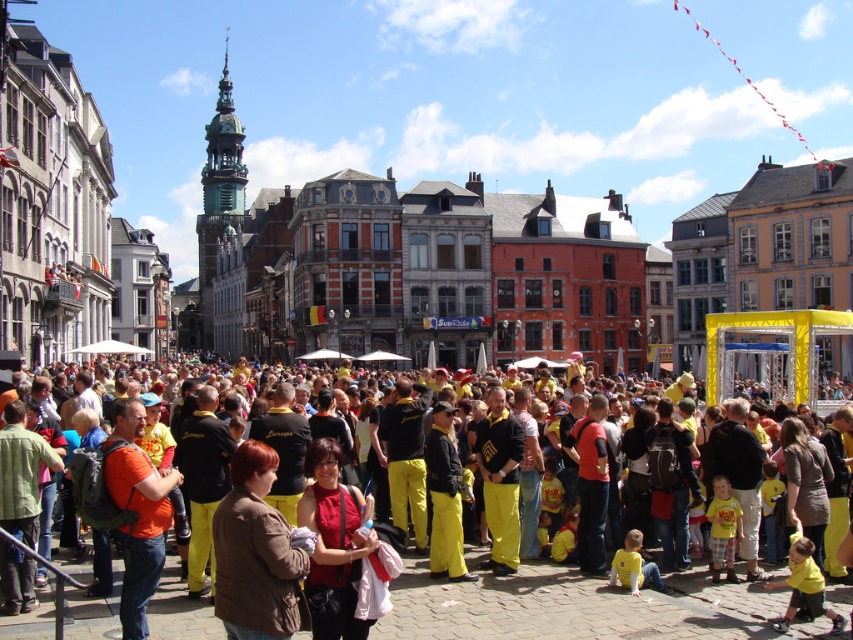
You are a photographer standing in the town square and want to take a photo of the brown leather jacket at center without the yellow fabric crowd at center blocking it. What should you do?

Since the yellow fabric crowd at center is closer to you than the brown leather jacket at center, you should move your position to get a better angle so that the yellow fabric crowd at center is no longer in front of the brown leather jacket at center.

You are a photographer standing in the crowd at the festival. You want to take a photo of both the brown leather jacket at center and the matte red blouse at center. Which clothing item will appear taller in the photo?

The matte red blouse at center will appear taller in the photo because it is taller than the brown leather jacket at center.

You are a photographer trying to capture the yellow fabric crowd at center in your shot. Based on their position, where should you aim your camera to ensure they are centered in the frame?

To center the yellow fabric crowd at center in your shot, aim your camera at the point with coordinates 0.945 on the x axis and 0.667 on the y axis.